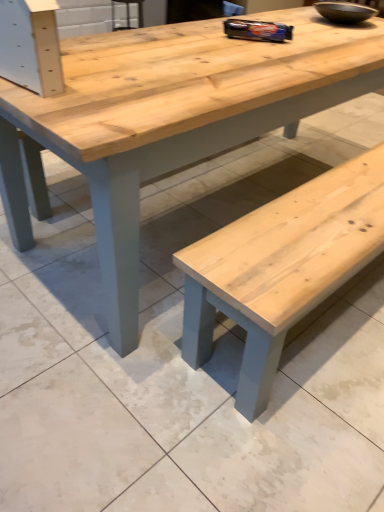
This screenshot has height=512, width=384. I want to click on natural wood table at center, so click(169, 120).

The image size is (384, 512). Describe the element at coordinates (169, 120) in the screenshot. I see `natural wood table at center` at that location.

Describe the element at coordinates (344, 12) in the screenshot. The width and height of the screenshot is (384, 512). I see `matte black bowl at upper right` at that location.

The width and height of the screenshot is (384, 512). Find the location of `matte black bowl at upper right`. matte black bowl at upper right is located at coordinates (344, 12).

Locate an element on the screen. Image resolution: width=384 pixels, height=512 pixels. natural wood table at center is located at coordinates (169, 120).

Is natural wood table at center at the right side of matte black bowl at upper right?

No, natural wood table at center is not to the right of matte black bowl at upper right.

Is the position of natural wood table at center less distant than that of matte black bowl at upper right?

Yes.

Is point (34, 134) farther from viewer compared to point (366, 12)?

No, it is in front of (366, 12).

In the scene shown: From the image's perspective, does natural wood table at center appear higher than matte black bowl at upper right?

No.

In the scene shown: From a real-world perspective, which object rests below the other?

natural wood table at center, from a real-world perspective.

In terms of width, does natural wood table at center look wider or thinner when compared to matte black bowl at upper right?

Considering their sizes, natural wood table at center looks broader than matte black bowl at upper right.

Is natural wood table at center taller than matte black bowl at upper right?

Correct, natural wood table at center is much taller as matte black bowl at upper right.

Between natural wood table at center and matte black bowl at upper right, which one has larger size?

Bigger between the two is natural wood table at center.

Is natural wood table at center situated inside matte black bowl at upper right or outside?

natural wood table at center cannot be found inside matte black bowl at upper right.

Is there a large distance between natural wood table at center and matte black bowl at upper right?

They are positioned close to each other.

Consider the image. Is natural wood table at center oriented towards matte black bowl at upper right?

No, natural wood table at center is not aimed at matte black bowl at upper right.

How many degrees apart are the facing directions of natural wood table at center and matte black bowl at upper right?

3.25 degrees.

At what (x,y) coordinates should I click in order to perform the action: click on bowl above the natural wood table at center (from the image's perspective). Please return your answer as a coordinate pair (x, y). Looking at the image, I should click on (344, 12).

Can you confirm if matte black bowl at upper right is positioned to the right of natural wood table at center?

Yes, matte black bowl at upper right is to the right of natural wood table at center.

Is matte black bowl at upper right in front of or behind natural wood table at center in the image?

Clearly, matte black bowl at upper right is behind natural wood table at center.

Which is closer to the camera, (355, 7) or (70, 128)?

Point (70, 128)

From the image's perspective, is matte black bowl at upper right under natural wood table at center?

No, from the image's perspective, matte black bowl at upper right is not beneath natural wood table at center.

From a real-world perspective, who is located higher, matte black bowl at upper right or natural wood table at center?

matte black bowl at upper right is physically above.

In terms of width, does matte black bowl at upper right look wider or thinner when compared to natural wood table at center?

In the image, matte black bowl at upper right appears to be more narrow than natural wood table at center.

Is matte black bowl at upper right shorter than natural wood table at center?

Yes, matte black bowl at upper right is shorter than natural wood table at center.

In terms of size, does matte black bowl at upper right appear bigger or smaller than natural wood table at center?

In the image, matte black bowl at upper right appears to be smaller than natural wood table at center.

Is matte black bowl at upper right not inside natural wood table at center?

Yes.

Does matte black bowl at upper right touch natural wood table at center?

No, matte black bowl at upper right is not touching natural wood table at center.

Does matte black bowl at upper right turn towards natural wood table at center?

No, matte black bowl at upper right is not facing towards natural wood table at center.

How different are the orientations of matte black bowl at upper right and natural wood table at center in degrees?

3.25 degrees separate the facing orientations of matte black bowl at upper right and natural wood table at center.

The width and height of the screenshot is (384, 512). What are the coordinates of `bowl that appears above the natural wood table at center (from the image's perspective)` in the screenshot? It's located at (344, 12).

Find the location of `table located below the matte black bowl at upper right (from the image's perspective)`. table located below the matte black bowl at upper right (from the image's perspective) is located at coordinates (169, 120).

This screenshot has height=512, width=384. I want to click on table that is in front of the matte black bowl at upper right, so coord(169,120).